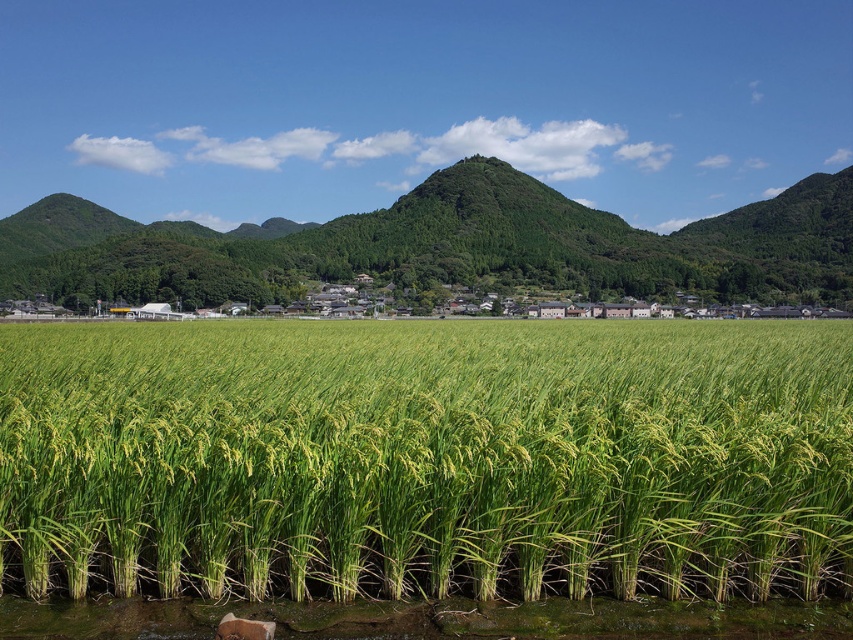
You are a farmer planning to plant crops in the green grassy rice field at center and the green grassy hill at center. Which area has more space available for planting?

The green grassy hill at center has more space available for planting because it occupies more area than the green grassy rice field at center.

You are standing in the middle of the green grassy rice field at center and want to reach the green grassy hill at center. Which direction should you walk to get there?

The green grassy rice field at center is positioned under the green grassy hill at center, so you should walk upwards to reach the green grassy hill at center.